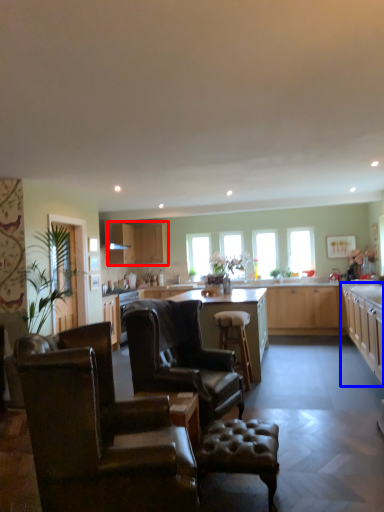
Question: Among these objects, which one is farthest to the camera, cabinetry (highlighted by a red box) or cabinetry (highlighted by a blue box)?

Choices:
 (A) cabinetry
 (B) cabinetry

Answer: (A)